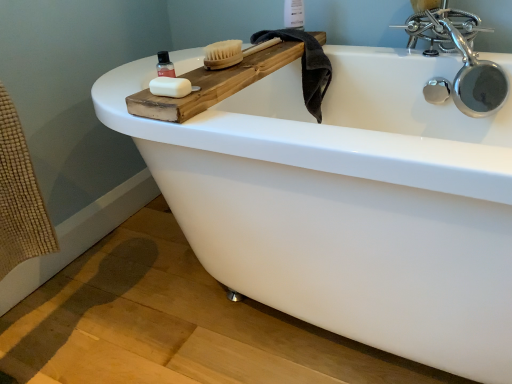
Question: Is translucent plastic bottle at upper left wider or thinner than white plastic bottle at upper center?

Choices:
 (A) wide
 (B) thin

Answer: (B)

Question: Considering the positions of translucent plastic bottle at upper left and white plastic bottle at upper center in the image, is translucent plastic bottle at upper left bigger or smaller than white plastic bottle at upper center?

Choices:
 (A) big
 (B) small

Answer: (B)

Question: Estimate the real-world distances between objects in this image. Which object is closer to the dark gray towel at upper right?

Choices:
 (A) polished chrome faucet at upper right
 (B) white plastic bottle at upper center
 (C) white matte soap at upper left
 (D) translucent plastic bottle at upper left
 (E) natural wood brush at upper center

Answer: (B)

Question: Estimate the real-world distances between objects in this image. Which object is closer to the white plastic bottle at upper center?

Choices:
 (A) translucent plastic bottle at upper left
 (B) polished chrome faucet at upper right
 (C) white matte soap at upper left
 (D) dark gray towel at upper right
 (E) natural wood brush at upper center

Answer: (D)